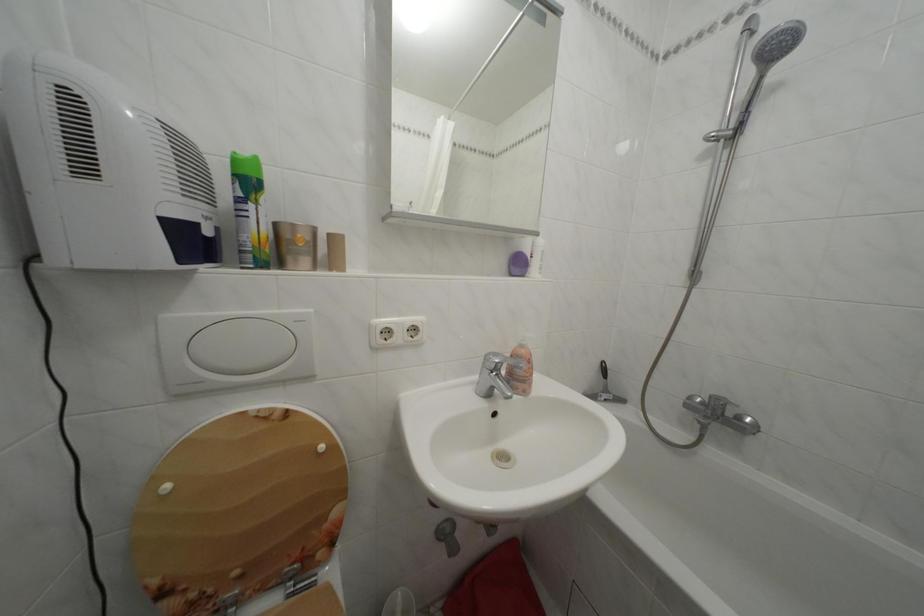
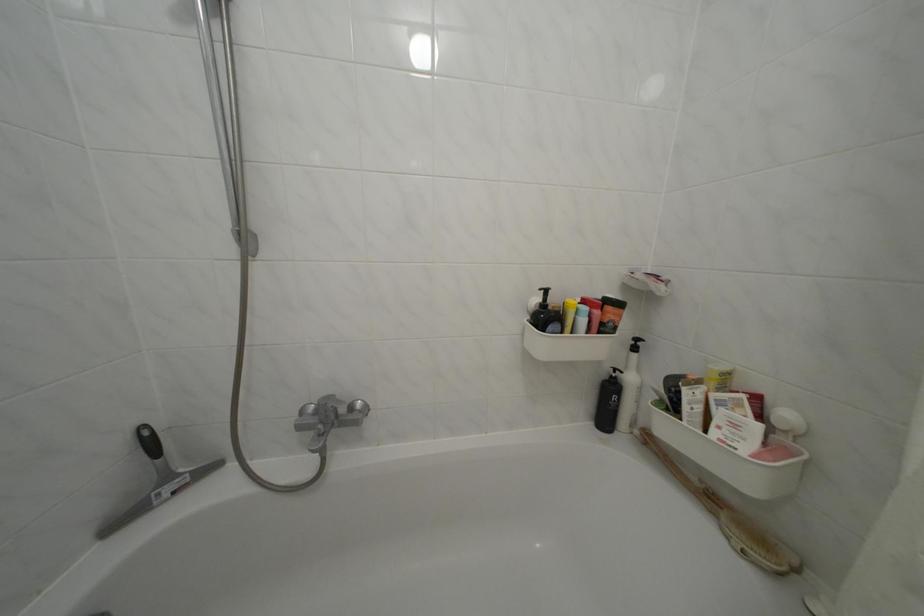
The point at (748, 424) is marked in the first image. Where is the corresponding point in the second image?

(359, 414)